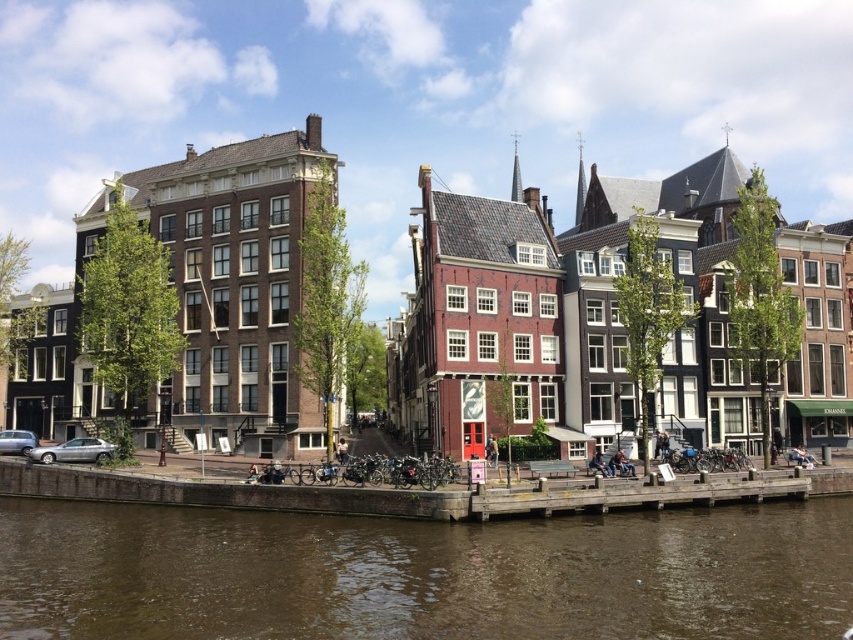
You are a tourist standing on the wooden dock at lower center and want to take a photo of the brown murky water at lower center. Can you see the entire water surface in your shot without moving your camera?

The brown murky water at lower center has a greater height compared to wooden dock at lower center, so the water is higher than the dock. Since you are standing on the dock, you might need to tilt your camera upwards to capture the entire water surface as it is elevated relative to your position.

You are a tourist standing on the wooden dock at lower center and want to take a photo of the brown murky water at lower center. Is the water visible from your current position on the dock?

The brown murky water at lower center is in front of the wooden dock at lower center, so yes, the water is visible from your current position on the dock.